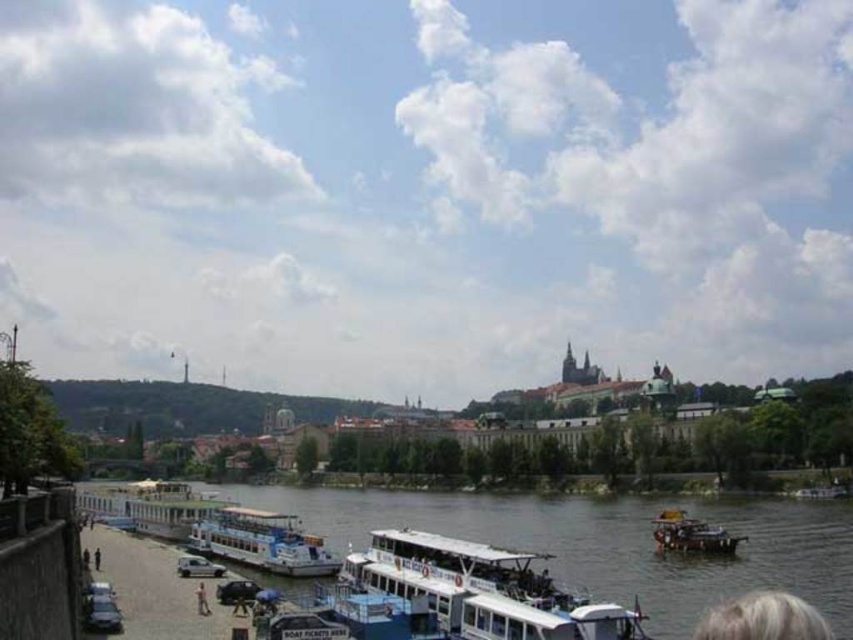
Question: Which point appears closest to the camera in this image?

Choices:
 (A) (582, 598)
 (B) (260, 500)
 (C) (97, 554)
 (D) (714, 538)

Answer: (A)

Question: Which object appears closest to the camera in this image?

Choices:
 (A) white smooth water at lower center
 (B) white plastic boat at center
 (C) wooden boat at lower right
 (D) white fabric umbrella at lower center

Answer: (B)

Question: Is white smooth water at lower center to the right of white plastic boat at center from the viewer's perspective?

Choices:
 (A) yes
 (B) no

Answer: (B)

Question: Does white smooth water at lower center appear on the right side of wooden boat at lower right?

Choices:
 (A) no
 (B) yes

Answer: (A)

Question: Which object is positioned farthest from the white smooth water at lower center?

Choices:
 (A) white fabric umbrella at lower center
 (B) white plastic boat at center
 (C) wooden boat at lower right
 (D) white plastic boat at lower center

Answer: (A)

Question: Can you confirm if white smooth water at lower center is wider than white plastic boat at center?

Choices:
 (A) yes
 (B) no

Answer: (A)